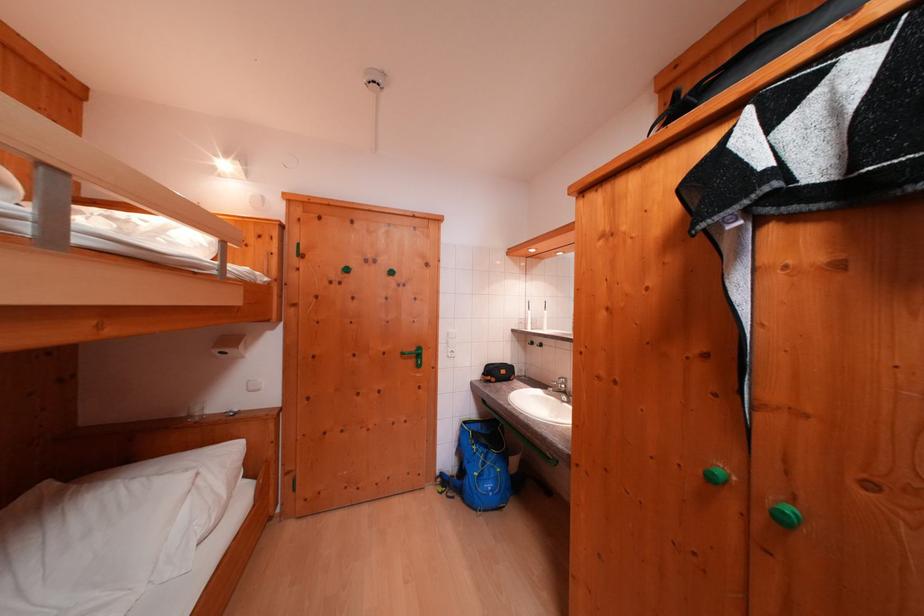
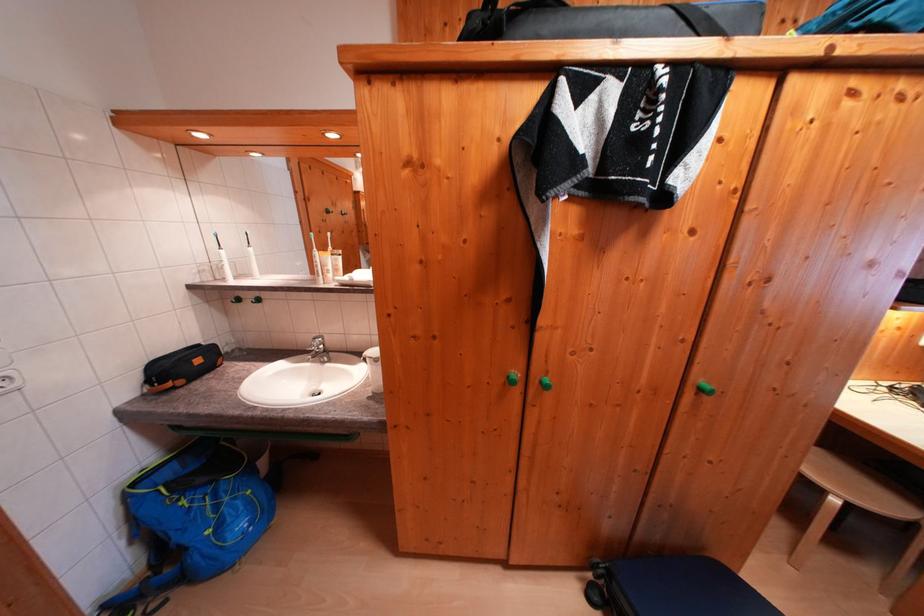
In the second image, find the point that corresponds to [473,427] in the first image.

(142, 488)